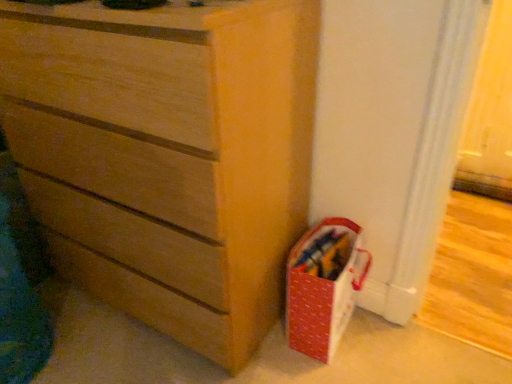
This screenshot has width=512, height=384. Find the location of `vacant area that is in front of red fabric basket at lower right`. vacant area that is in front of red fabric basket at lower right is located at coordinates (330, 367).